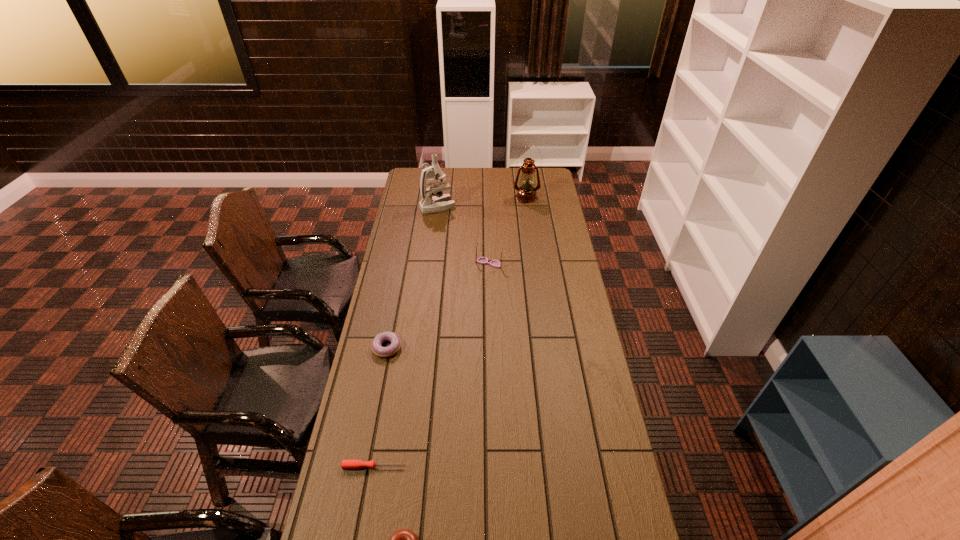
Where is `vacant space at the far right corner of the desktop`? The height and width of the screenshot is (540, 960). vacant space at the far right corner of the desktop is located at coordinates (542, 183).

Find the location of `empty location between the shortest object and the microscope`. empty location between the shortest object and the microscope is located at coordinates (406, 336).

This screenshot has height=540, width=960. What are the coordinates of `blank region between the microscope and the fourth shortest object` in the screenshot? It's located at (464, 235).

This screenshot has width=960, height=540. I want to click on vacant space that is in between the fourth nearest object and the microscope, so click(x=464, y=235).

I want to click on free point between the microscope and the rightmost object, so click(x=482, y=202).

At what (x,y) coordinates should I click in order to perform the action: click on free space that is in between the farther doughnut and the shortest object. Please return your answer as a coordinate pair (x, y). Looking at the image, I should click on (380, 407).

The image size is (960, 540). Find the location of `free space that is in between the fourth shortest object and the rightmost object`. free space that is in between the fourth shortest object and the rightmost object is located at coordinates (508, 231).

Choose which object is the fifth nearest neighbor to the oil lamp. Please provide its 2D coordinates. Your answer should be formatted as a tuple, i.e. [(x, y)], where the tuple contains the x and y coordinates of a point satisfying the conditions above.

[(404, 539)]

Identify which object is the fifth closest to the farther doughnut. Please provide its 2D coordinates. Your answer should be formatted as a tuple, i.e. [(x, y)], where the tuple contains the x and y coordinates of a point satisfying the conditions above.

[(526, 193)]

The height and width of the screenshot is (540, 960). What are the coordinates of `vacant space that satisfies the following two spatial constraints: 1. on the back side of the second object from right to left; 2. on the right side of the oil lamp` in the screenshot? It's located at (488, 197).